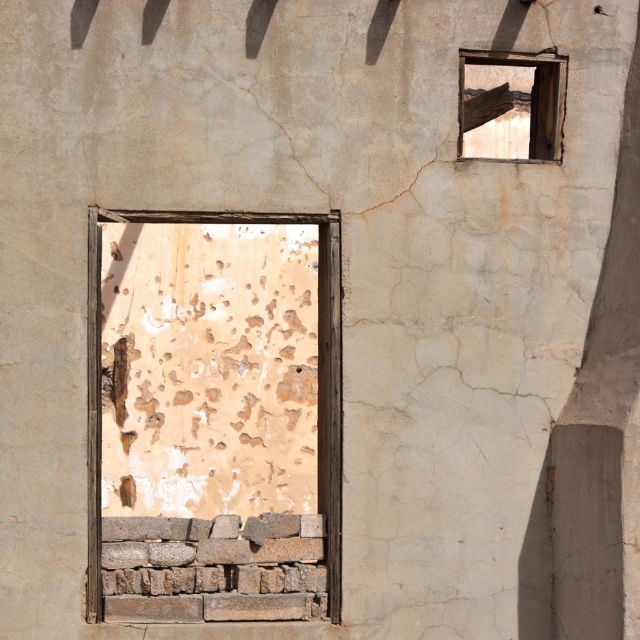
You are an architect assessing the structural integrity of the old building. You notice two wooden frames, the brown wooden window frame at center and the wooden frame at upper right. Which frame has a greater width according to the measurements?

The wooden frame at upper right has a greater width than the brown wooden window frame at center.